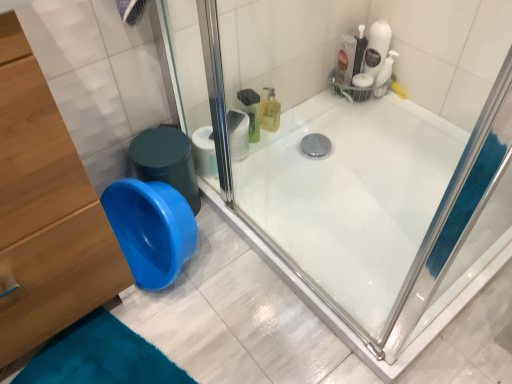
Find the location of a particular element. Image resolution: width=512 pixels, height=384 pixels. vacant point to the right of blue plastic potty at lower left is located at coordinates (226, 216).